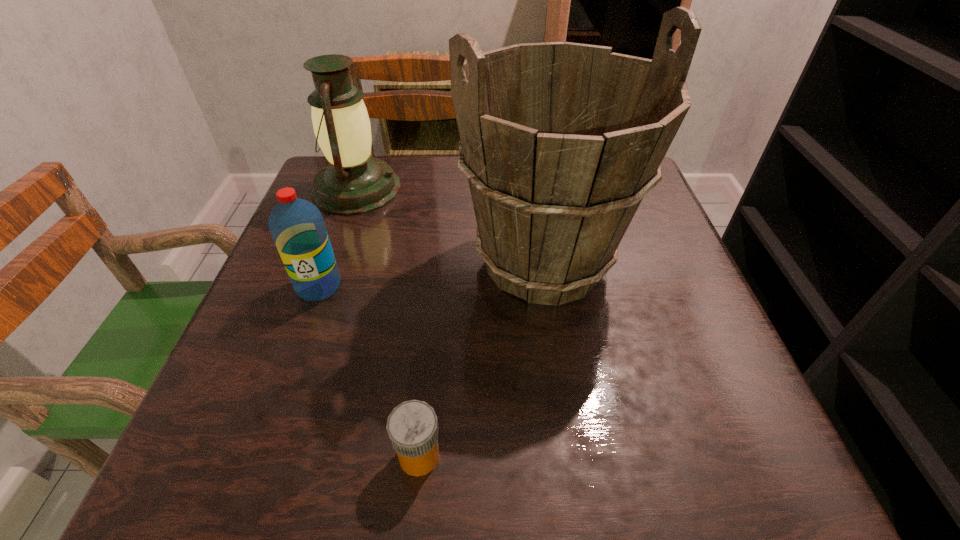
I want to click on free space between the rightmost object and the second shortest object, so click(432, 274).

The image size is (960, 540). In order to click on object that is the closest to the nearest object in this screenshot , I will do `click(560, 142)`.

I want to click on object that ranks as the second closest to the rightmost object, so click(x=412, y=426).

Find the location of `vacant space that satisfies the following two spatial constraints: 1. with the light compartment facing forward on the lantern; 2. on the front label of the water bottle`. vacant space that satisfies the following two spatial constraints: 1. with the light compartment facing forward on the lantern; 2. on the front label of the water bottle is located at coordinates (323, 286).

This screenshot has height=540, width=960. Find the location of `free point that satisfies the following two spatial constraints: 1. with the light compartment facing forward on the third shortest object; 2. on the back side of the tallest object`. free point that satisfies the following two spatial constraints: 1. with the light compartment facing forward on the third shortest object; 2. on the back side of the tallest object is located at coordinates (331, 262).

You are a GUI agent. You are given a task and a screenshot of the screen. Output one action in this format:
    pyautogui.click(x=<x>, y=<y>)
    Task: Click on the free spot that satisfies the following two spatial constraints: 1. with the light compartment facing forward on the lantern; 2. on the left side of the rightmost object
    The image size is (960, 540).
    Given the screenshot: What is the action you would take?
    pyautogui.click(x=331, y=262)

The image size is (960, 540). In order to click on vacant region that satisfies the following two spatial constraints: 1. on the front side of the bucket; 2. on the label side of the nearest object in this screenshot , I will do `click(573, 456)`.

Locate an element on the screen. This screenshot has height=540, width=960. free spot that satisfies the following two spatial constraints: 1. with the light compartment facing forward on the second tallest object; 2. on the front label of the second shortest object is located at coordinates (323, 286).